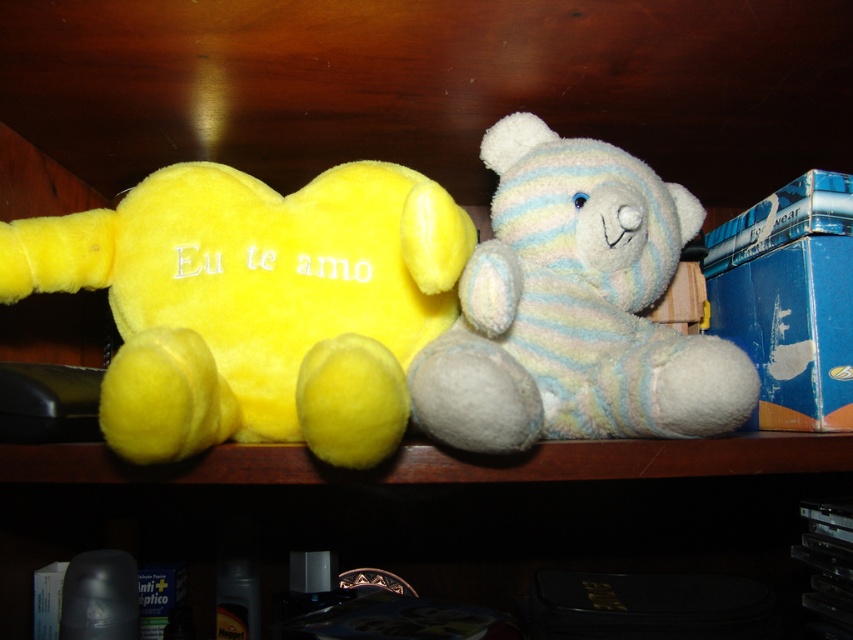
Question: Does yellow plush heart at center appear on the right side of white soft teddy bear at center?

Choices:
 (A) yes
 (B) no

Answer: (B)

Question: Is yellow plush heart at center to the right of white soft teddy bear at center from the viewer's perspective?

Choices:
 (A) no
 (B) yes

Answer: (A)

Question: Among these objects, which one is farthest from the camera?

Choices:
 (A) white soft teddy bear at center
 (B) yellow plush heart at center

Answer: (A)

Question: Can you confirm if yellow plush heart at center is positioned to the right of white soft teddy bear at center?

Choices:
 (A) no
 (B) yes

Answer: (A)